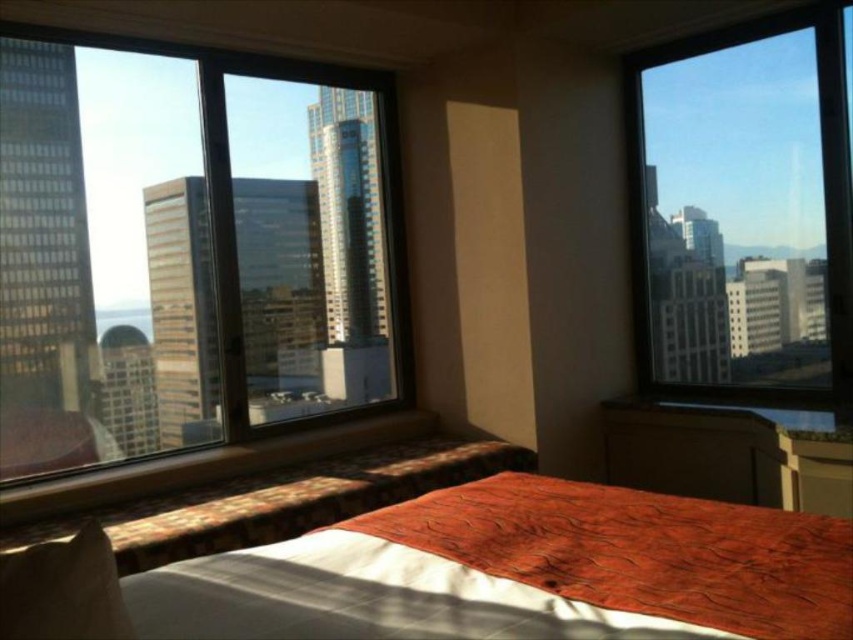
Question: Observing the image, what is the correct spatial positioning of textured orange bedspread at center in reference to white soft pillow at lower left?

Choices:
 (A) below
 (B) above

Answer: (A)

Question: Does textured orange bedspread at center appear on the right side of white soft pillow at lower left?

Choices:
 (A) no
 (B) yes

Answer: (B)

Question: Which point is farther to the camera?

Choices:
 (A) transparent glass window at left
 (B) white soft pillow at lower left

Answer: (A)

Question: Based on their relative distances, which object is farther from the textured orange bedspread at center?

Choices:
 (A) transparent glass window at right
 (B) white soft pillow at lower left
 (C) transparent glass window at left

Answer: (A)

Question: Is transparent glass window at left bigger than textured orange bedspread at center?

Choices:
 (A) yes
 (B) no

Answer: (A)

Question: Which of the following is the closest to the observer?

Choices:
 (A) (631, 156)
 (B) (177, 160)
 (C) (750, 611)
 (D) (49, 563)

Answer: (D)